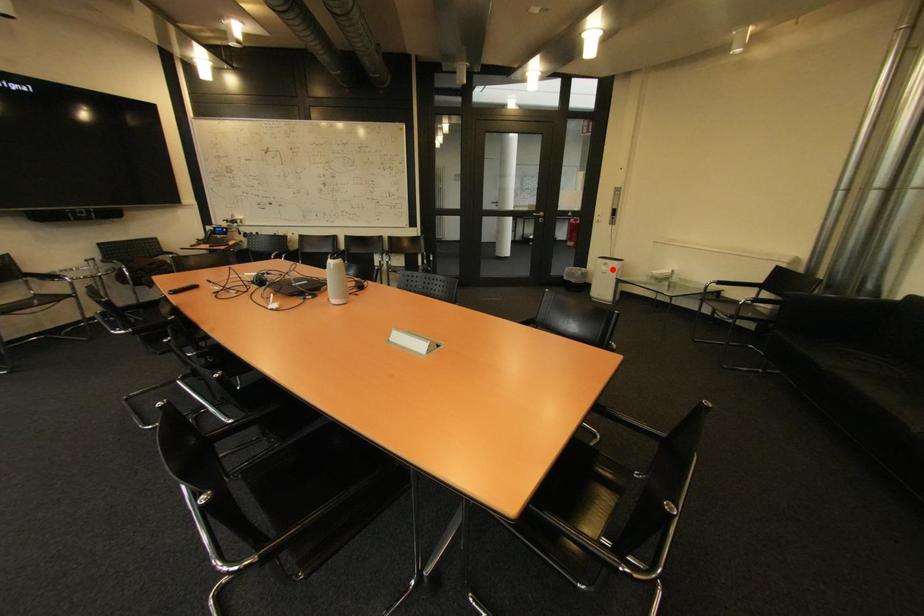
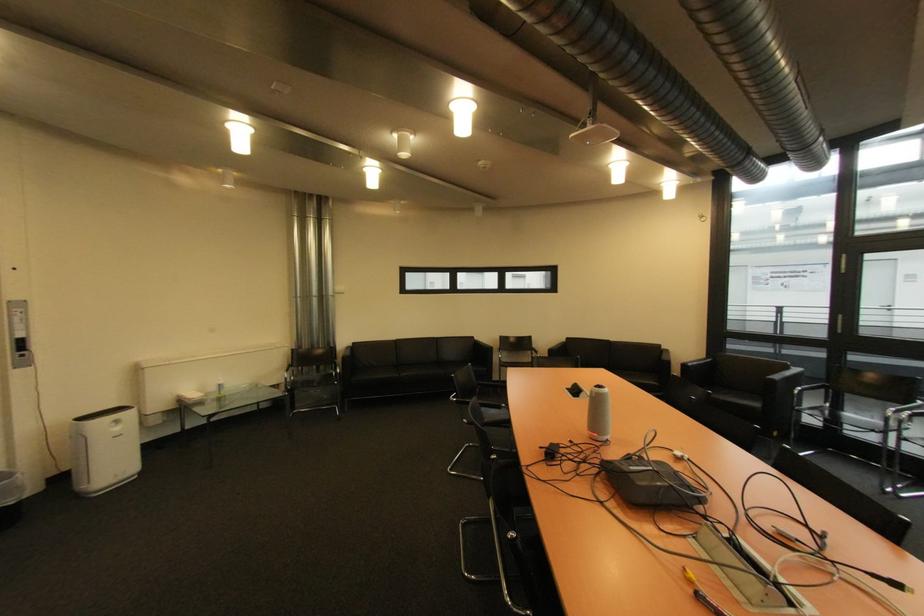
The point at the highlighted location is marked in the first image. Where is the corresponding point in the second image?

(124, 430)